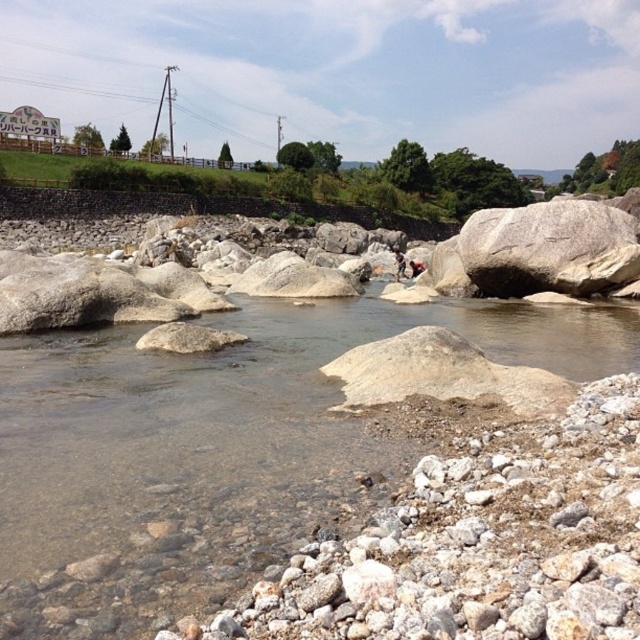
Question: Does clear water at center come behind gray granite boulder at center-right?

Choices:
 (A) no
 (B) yes

Answer: (A)

Question: Which point appears farthest from the camera in this image?

Choices:
 (A) (403, 266)
 (B) (214, 324)
 (C) (634, 269)

Answer: (A)

Question: Can you confirm if clear water at center is wider than dark brown leather jacket at center?

Choices:
 (A) yes
 (B) no

Answer: (A)

Question: Which object is farther from the camera taking this photo?

Choices:
 (A) gray granite boulder at center-right
 (B) clear water at center

Answer: (A)

Question: Which is farther from the clear water at center?

Choices:
 (A) gray granite boulder at center-right
 (B) dark brown leather jacket at center

Answer: (B)

Question: Can you confirm if gray granite boulder at center-right is thinner than dark brown leather jacket at center?

Choices:
 (A) yes
 (B) no

Answer: (B)